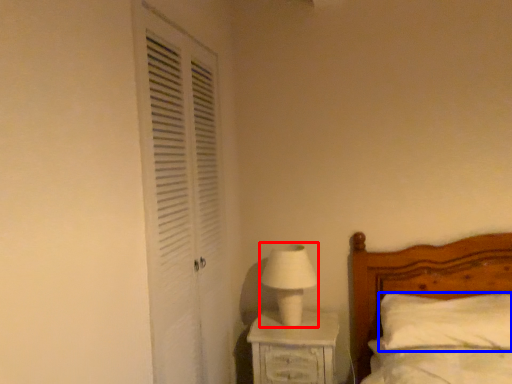
Question: Which object appears closest to the camera in this image, table lamp (highlighted by a red box) or pillow (highlighted by a blue box)?

Choices:
 (A) table lamp
 (B) pillow

Answer: (B)